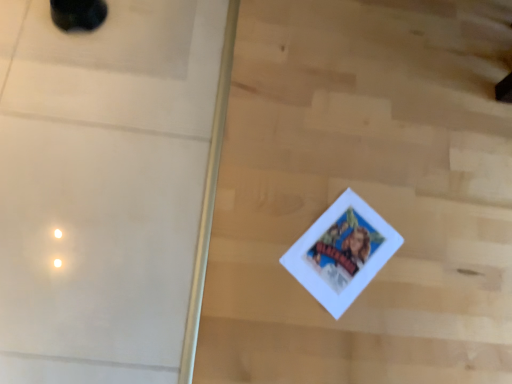
Question: Is white glossy screen door at upper left wider or thinner than black rubber shoe at upper left?

Choices:
 (A) wide
 (B) thin

Answer: (A)

Question: Is white glossy screen door at upper left to the left or to the right of black rubber shoe at upper left in the image?

Choices:
 (A) right
 (B) left

Answer: (A)

Question: In the image, is white glossy screen door at upper left positioned in front of or behind black rubber shoe at upper left?

Choices:
 (A) behind
 (B) front

Answer: (B)

Question: From the image's perspective, is black rubber shoe at upper left positioned above or below white glossy screen door at upper left?

Choices:
 (A) below
 (B) above

Answer: (B)

Question: In terms of size, does black rubber shoe at upper left appear bigger or smaller than white glossy screen door at upper left?

Choices:
 (A) small
 (B) big

Answer: (A)

Question: Which is correct: black rubber shoe at upper left is inside white glossy screen door at upper left, or outside of it?

Choices:
 (A) outside
 (B) inside

Answer: (A)

Question: From their relative heights in the image, would you say black rubber shoe at upper left is taller or shorter than white glossy screen door at upper left?

Choices:
 (A) short
 (B) tall

Answer: (B)